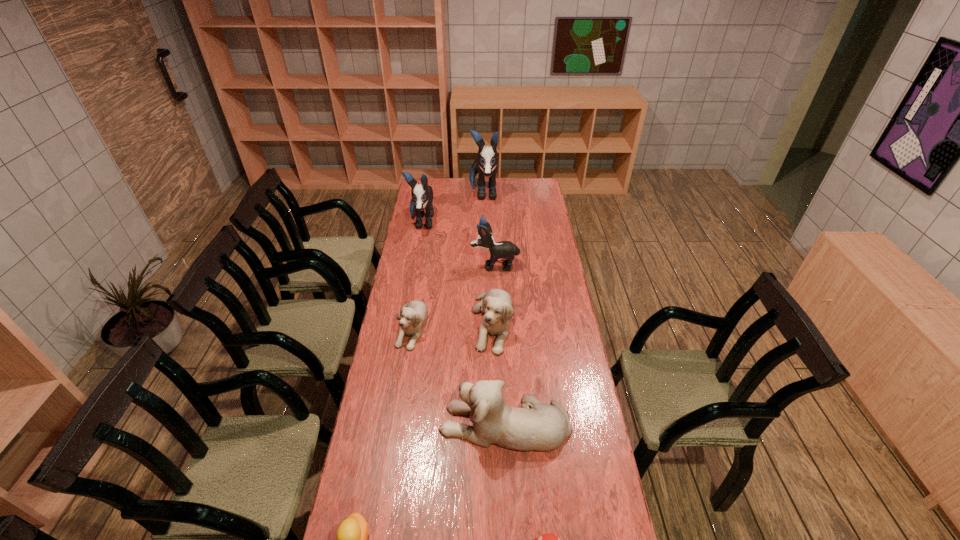
Locate an element on the screen. the third shortest object is located at coordinates (413, 315).

In order to click on the smallest white puppy in this screenshot , I will do `click(413, 315)`.

Find the location of a particular element. This screenshot has width=960, height=540. vacant space situated 0.140m on the front-facing side of the tallest puppy is located at coordinates (484, 226).

At what (x,y) coordinates should I click in order to perform the action: click on vacant space situated on the front-facing side of the seventh shortest object. Please return your answer as a coordinate pair (x, y). The width and height of the screenshot is (960, 540). Looking at the image, I should click on (412, 278).

Find the location of a particular element. The width and height of the screenshot is (960, 540). vacant space located on the front-facing side of the smallest black puppy is located at coordinates (440, 265).

I want to click on free space located 0.160m on the front-facing side of the smallest black puppy, so click(x=438, y=265).

Where is `free space located on the front-facing side of the smallest black puppy`? free space located on the front-facing side of the smallest black puppy is located at coordinates (409, 265).

This screenshot has width=960, height=540. I want to click on vacant space located on the front-facing side of the nearest white puppy, so click(392, 424).

This screenshot has width=960, height=540. I want to click on vacant space situated 0.130m on the front-facing side of the nearest white puppy, so click(401, 424).

At what (x,y) coordinates should I click in order to perform the action: click on vacant region located 0.170m on the front-facing side of the nearest white puppy. Please return your answer as a coordinate pair (x, y). Image resolution: width=960 pixels, height=540 pixels. Looking at the image, I should click on (389, 424).